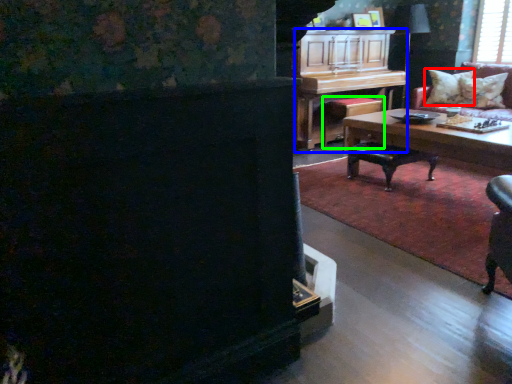
Question: Which object is positioned farthest from pillow (highlighted by a red box)? Select from piano (highlighted by a blue box) and stool (highlighted by a green box).

Choices:
 (A) piano
 (B) stool

Answer: (A)